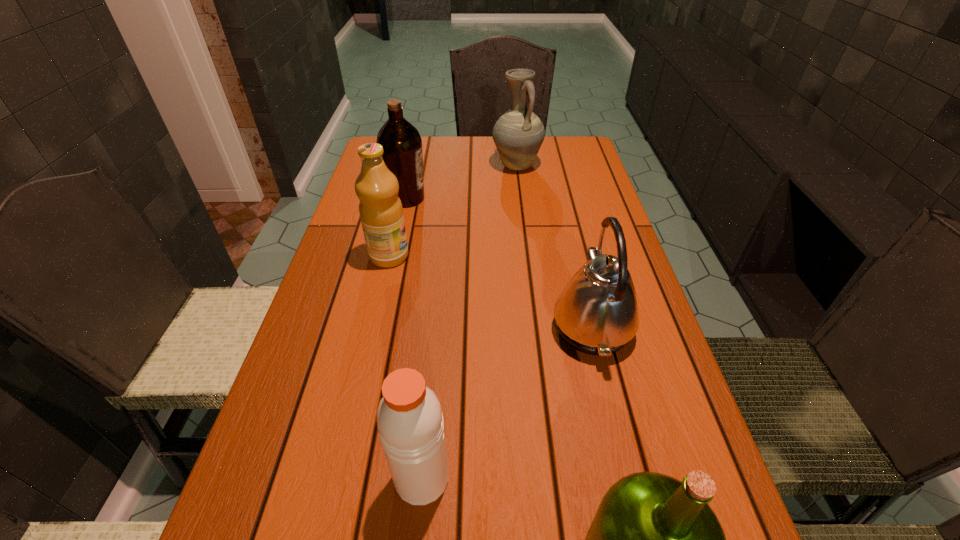
At what (x,y) coordinates should I click in order to perform the action: click on pitcher. Please return your answer as a coordinate pair (x, y). The width and height of the screenshot is (960, 540). Looking at the image, I should click on (518, 134).

Where is `the fourth nearest object`? The height and width of the screenshot is (540, 960). the fourth nearest object is located at coordinates (x=381, y=212).

You are a GUI agent. You are given a task and a screenshot of the screen. Output one action in this format:
    pyautogui.click(x=<x>, y=<y>)
    Task: Click on the farthest olive oil
    
    Given the screenshot: What is the action you would take?
    pyautogui.click(x=402, y=144)

Find the location of a particular element. Image resolution: width=960 pixels, height=540 pixels. the third nearest object is located at coordinates (596, 313).

Locate an element on the screen. the fifth farthest object is located at coordinates pos(409,417).

Where is `shaker`? This screenshot has width=960, height=540. shaker is located at coordinates (409, 417).

You are a GUI agent. You are given a task and a screenshot of the screen. Output one action in this format:
    pyautogui.click(x=<x>, y=<y>)
    Task: Click on the vacant space situated 0.120m on the handle side of the farthest object
    This screenshot has height=540, width=960.
    Given the screenshot: What is the action you would take?
    pyautogui.click(x=520, y=200)

Where is `free space located 0.190m on the label of the second farthest olive oil`? free space located 0.190m on the label of the second farthest olive oil is located at coordinates (486, 256).

The height and width of the screenshot is (540, 960). In order to click on vacant space located 0.280m on the label of the fifth nearest object in this screenshot , I will do (x=523, y=198).

The image size is (960, 540). Find the location of `vacant region located 0.090m from the spout of the kettle`. vacant region located 0.090m from the spout of the kettle is located at coordinates (509, 327).